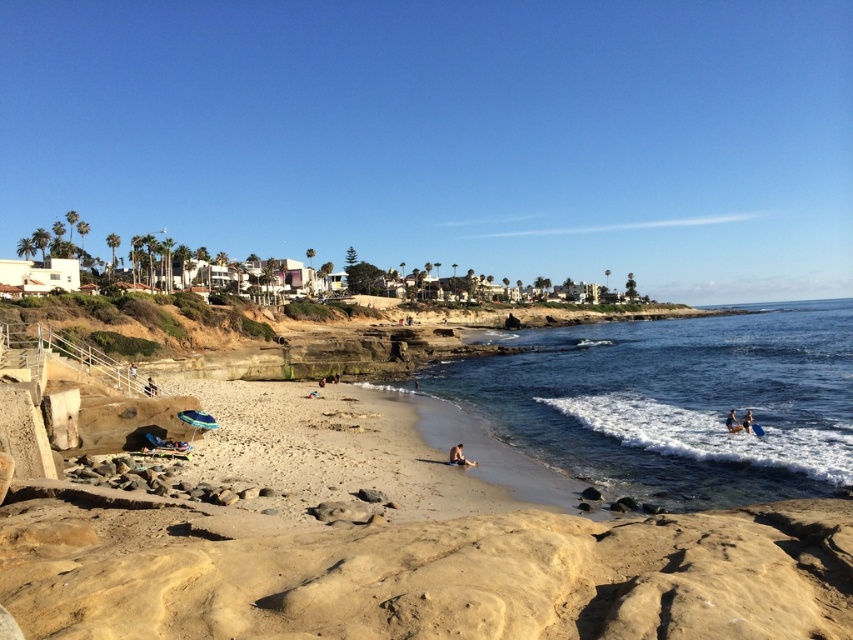
Question: Which object is closer to the camera taking this photo?

Choices:
 (A) tan fabric towel at lower left
 (B) smooth tan skin at lower right
 (C) clear blue water at beach right

Answer: (C)

Question: Does smooth tan skin at lower right have a larger size compared to tan fabric towel at lower left?

Choices:
 (A) no
 (B) yes

Answer: (A)

Question: Which point is closer to the camera?

Choices:
 (A) (519, 422)
 (B) (146, 392)

Answer: (B)

Question: Is tan fabric towel at lower left thinner than light brown wooden chair at lower left?

Choices:
 (A) yes
 (B) no

Answer: (B)

Question: From the image, what is the correct spatial relationship of light brown sandy beach at center in relation to blue fabric surfboard at lower right?

Choices:
 (A) left
 (B) right

Answer: (A)

Question: Which point is closer to the camera?

Choices:
 (A) pyautogui.click(x=735, y=420)
 (B) pyautogui.click(x=128, y=364)
 (C) pyautogui.click(x=196, y=387)

Answer: (A)